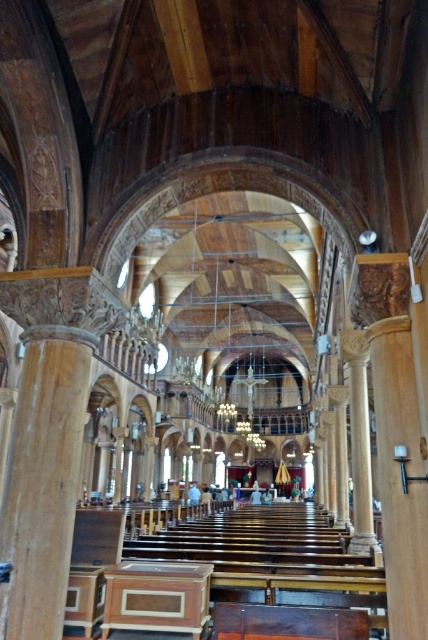
Question: Which point is closer to the camera?

Choices:
 (A) (385, 403)
 (B) (24, 428)
 (C) (184, 602)

Answer: (A)

Question: Estimate the real-world distances between objects in this image. Which object is closer to the wooden altar at center?

Choices:
 (A) wooden column at center
 (B) polished wood column at center

Answer: (B)

Question: Observing the image, what is the correct spatial positioning of wooden column at center in reference to wooden altar at center?

Choices:
 (A) above
 (B) below

Answer: (A)

Question: Is polished wood column at center above wooden column at center?

Choices:
 (A) no
 (B) yes

Answer: (A)

Question: Which point is farther from the camera taking this photo?

Choices:
 (A) (118, 586)
 (B) (59, 348)

Answer: (B)

Question: Does polished wood column at center have a greater width compared to wooden altar at center?

Choices:
 (A) yes
 (B) no

Answer: (B)